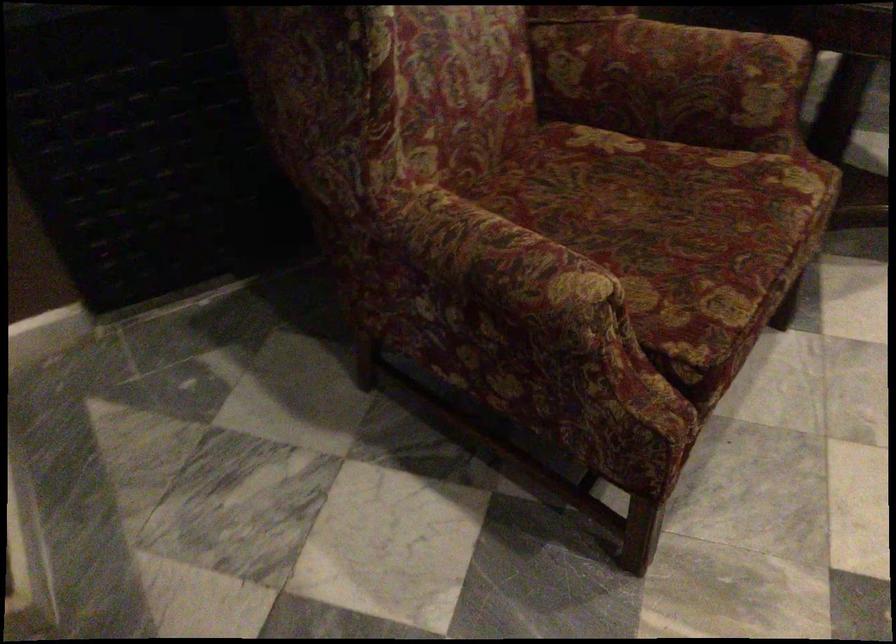
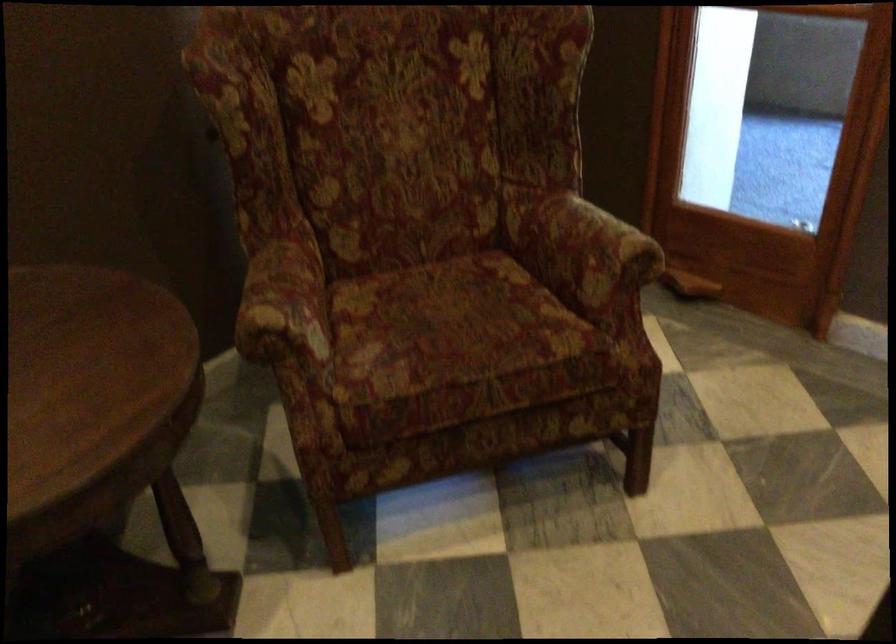
Question: In a continuous first-person perspective shot, in which direction is the camera moving?

Choices:
 (A) Left
 (B) Right
 (C) Forward
 (D) Backward

Answer: (B)